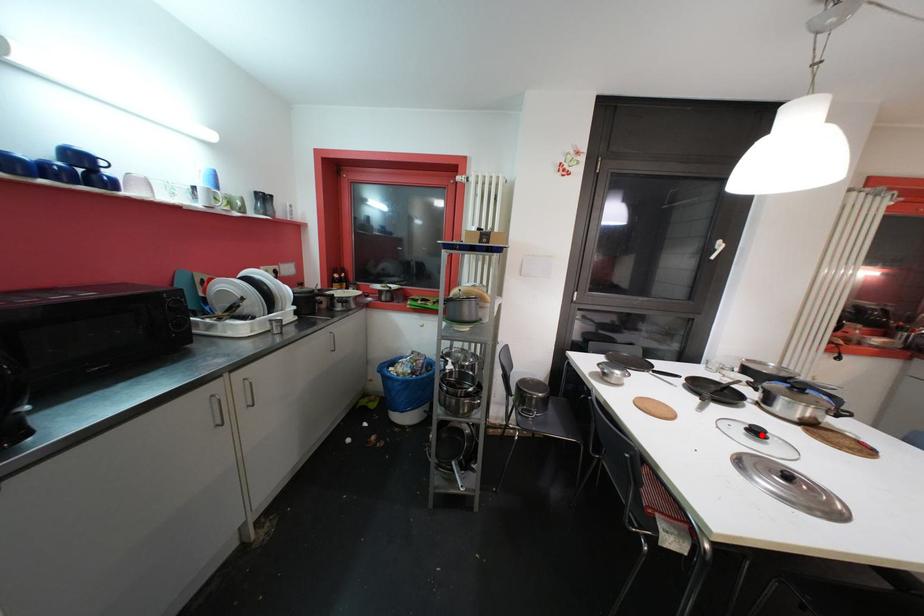
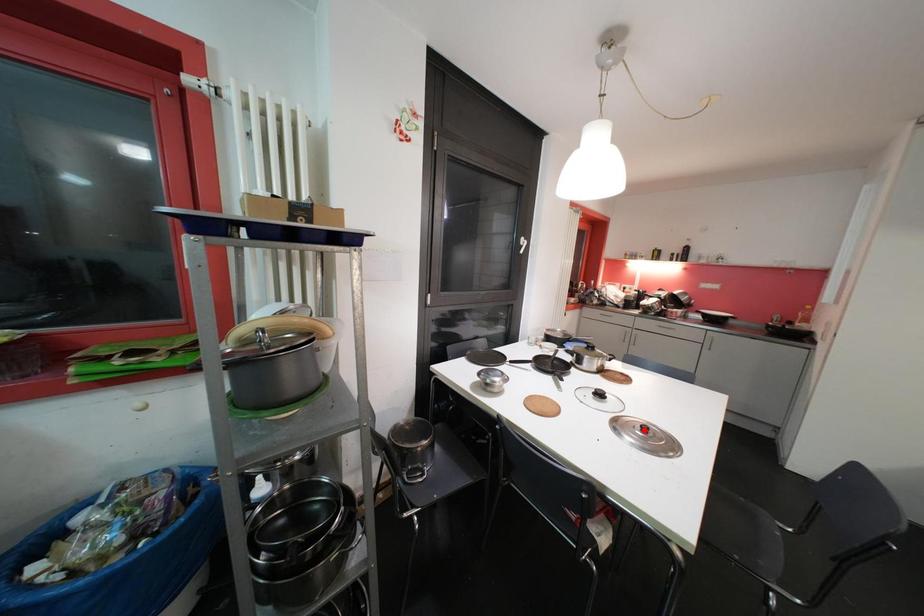
I am providing you with two images of the same scene from different viewpoints. A red point is marked on the first image and another point is marked on the second image. Is the red point in image1 aligned with the point shown in image2?

No